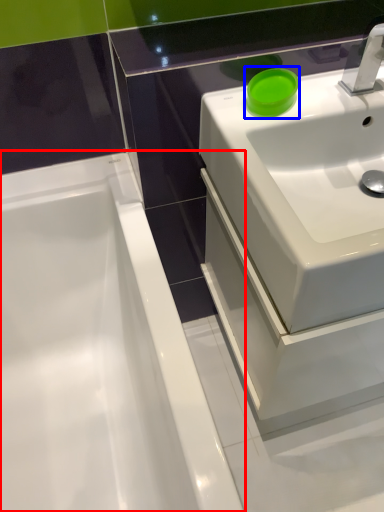
Question: Which object appears farthest to the camera in this image, bathtub (highlighted by a red box) or teal (highlighted by a blue box)?

Choices:
 (A) bathtub
 (B) teal

Answer: (B)